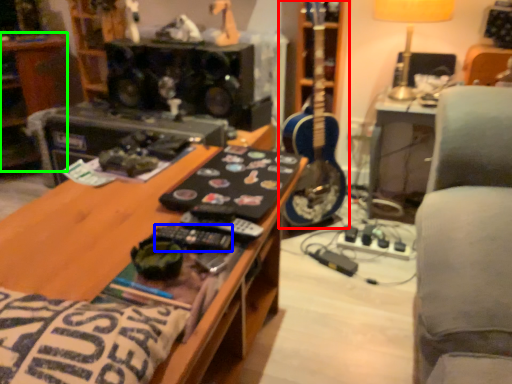
Question: Considering the real-world distances, which object is farthest from guitar (highlighted by a red box)? control (highlighted by a blue box) or shelf (highlighted by a green box)?

Choices:
 (A) control
 (B) shelf

Answer: (B)